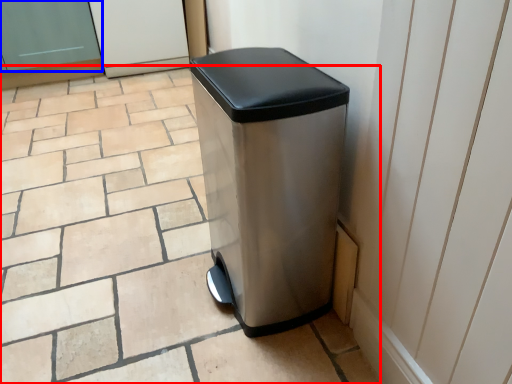
Question: Which point is further to the camera, tile (highlighted by a red box) or screen door (highlighted by a blue box)?

Choices:
 (A) tile
 (B) screen door

Answer: (B)